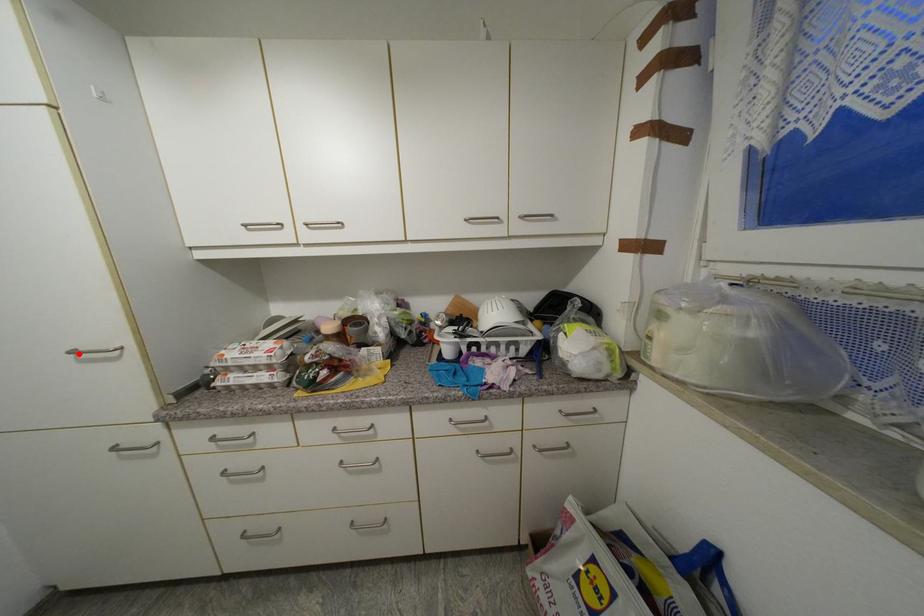
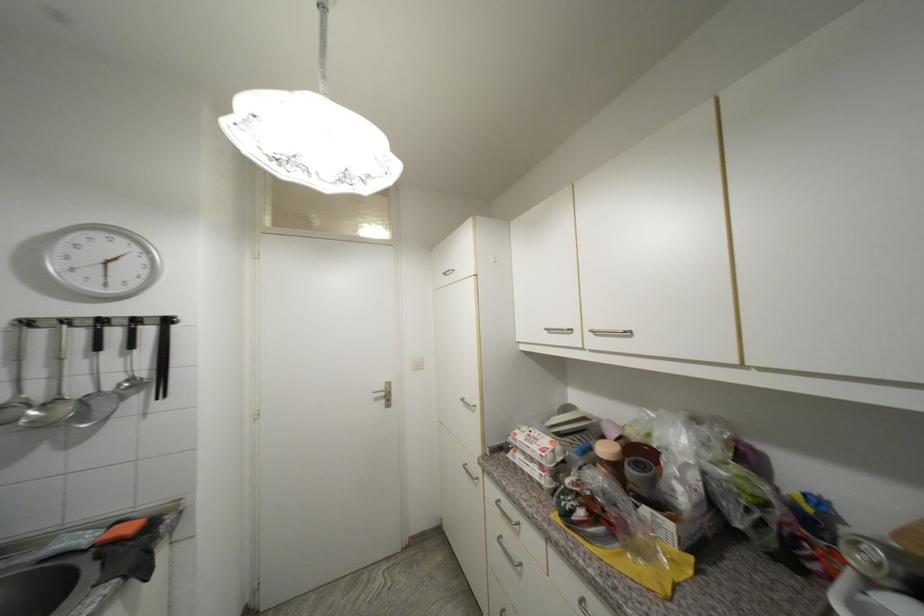
Locate, in the second image, the point that corresponds to the highlighted location in the first image.

(468, 400)